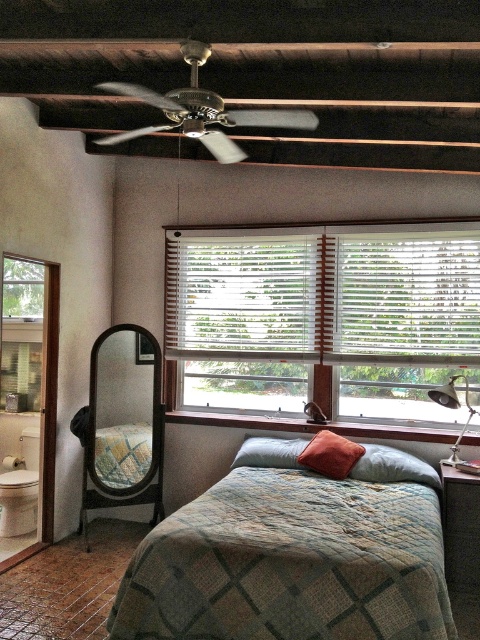
You are arranging flowers in the bedroom and need to place them between the textured green quilt at center and the velvet red pillow at center. Which object should you place the flowers closer to if you want them to be on the right side of the quilt?

The flowers should be placed closer to the velvet red pillow at center because the textured green quilt at center is positioned to its left, so the right side of the quilt is near the pillow.

You are standing at the center of the bedroom and want to hang a small fairy light decoration. You have a point marked at coordinates point (203, 109). Where exactly is this point located in the room?

The point (203, 109) is located on the metallic ceiling fan at upper center.

You are standing in the bedroom and want to hang two decorative items on the wall in front of the window. The first item should be placed at point (x=368, y=548) and the second at point (x=436, y=481). Which point is closer to you when you are facing the wall?

Point (x=368, y=548) is closer to the viewer than point (x=436, y=481).